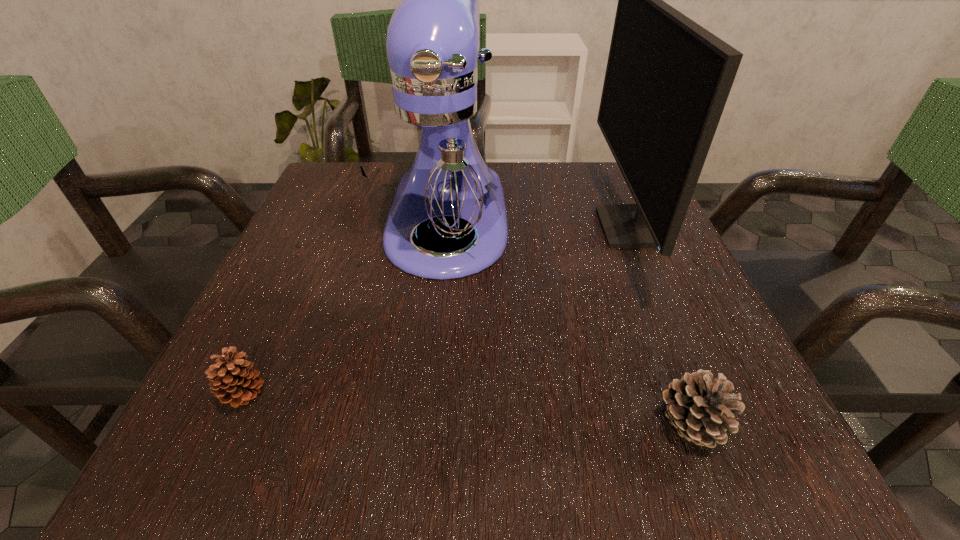
Locate an element on the screen. This screenshot has width=960, height=540. unoccupied area between the leftmost object and the right pinecone is located at coordinates (468, 410).

Find the location of `free area in between the computer monitor and the right pinecone`. free area in between the computer monitor and the right pinecone is located at coordinates (660, 326).

Find the location of a particular element. This screenshot has height=540, width=960. blank region between the computer monitor and the left pinecone is located at coordinates point(438,312).

Find the location of a particular element. Image resolution: width=960 pixels, height=540 pixels. free spot between the computer monitor and the third object from right to left is located at coordinates (539, 225).

Locate an element on the screen. The height and width of the screenshot is (540, 960). object that is the third closest to the second object from left to right is located at coordinates (701, 410).

You are a GUI agent. You are given a task and a screenshot of the screen. Output one action in this format:
    pyautogui.click(x=<x>, y=<y>)
    Task: Click on the closest object to the third object from right to left
    This screenshot has width=960, height=540.
    Given the screenshot: What is the action you would take?
    pyautogui.click(x=667, y=80)

I want to click on vacant space that satisfies the following two spatial constraints: 1. at the mixing area of the right pinecone; 2. on the right side of the mixer, so (428, 424).

You are a GUI agent. You are given a task and a screenshot of the screen. Output one action in this format:
    pyautogui.click(x=<x>, y=<y>)
    Task: Click on the vacant space that satisfies the following two spatial constraints: 1. on the front side of the right pinecone; 2. on the left side of the left pinecone
    This screenshot has width=960, height=540.
    Given the screenshot: What is the action you would take?
    pyautogui.click(x=231, y=424)

Locate an element on the screen. The width and height of the screenshot is (960, 540). free region that satisfies the following two spatial constraints: 1. on the front-facing side of the computer monitor; 2. on the front side of the right pinecone is located at coordinates (715, 424).